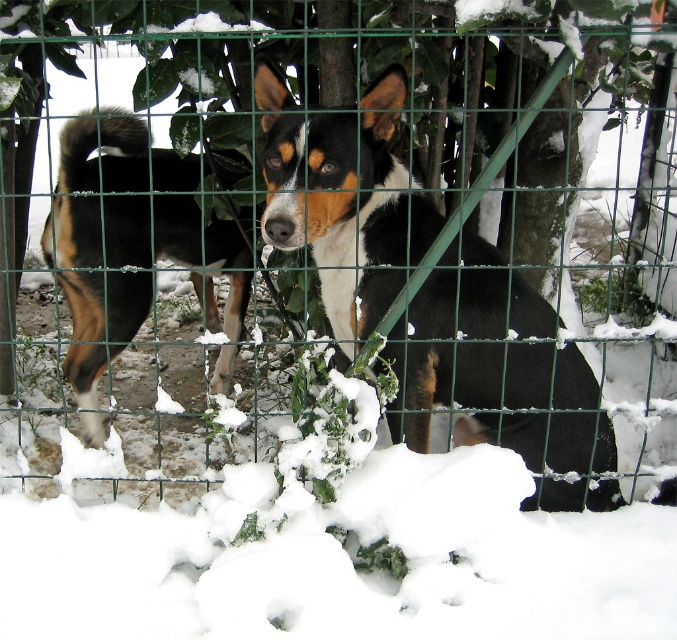
Consider the image. Between black and tan fur dog at center and brown and white fur at center, which one is positioned higher?

brown and white fur at center

Measure the distance between black and tan fur dog at center and brown and white fur at center.

They are 39.22 inches apart.

At what (x,y) coordinates should I click in order to perform the action: click on black and tan fur dog at center. Please return your answer as a coordinate pair (x, y). Looking at the image, I should click on (500, 376).

Locate an element on the screen. This screenshot has width=677, height=640. black and tan fur dog at center is located at coordinates (500, 376).